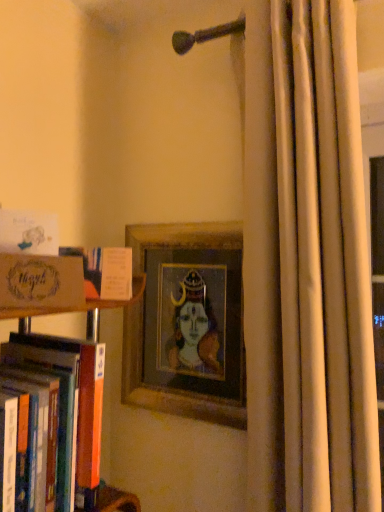
Question: From a real-world perspective, is matte cardboard box at left located beneath beige fabric curtain at right?

Choices:
 (A) no
 (B) yes

Answer: (B)

Question: Can you see matte cardboard box at left touching beige fabric curtain at right?

Choices:
 (A) yes
 (B) no

Answer: (B)

Question: Does matte cardboard box at left lie behind beige fabric curtain at right?

Choices:
 (A) no
 (B) yes

Answer: (A)

Question: From a real-world perspective, is matte cardboard box at left on beige fabric curtain at right?

Choices:
 (A) no
 (B) yes

Answer: (A)

Question: Can you confirm if matte cardboard box at left is shorter than beige fabric curtain at right?

Choices:
 (A) yes
 (B) no

Answer: (A)

Question: From the image's perspective, is wooden picture frame at center above or below matte paper card at left, the 1th book when ordered from top to bottom?

Choices:
 (A) below
 (B) above

Answer: (A)

Question: From their relative heights in the image, would you say wooden picture frame at center is taller or shorter than matte paper card at left, the 1th book when ordered from top to bottom?

Choices:
 (A) short
 (B) tall

Answer: (B)

Question: Choose the correct answer: Is wooden picture frame at center inside matte paper card at left, the 1th book when ordered from top to bottom, or outside it?

Choices:
 (A) outside
 (B) inside

Answer: (A)

Question: From a real-world perspective, is wooden picture frame at center physically located above or below matte paper card at left, marked as the third book in a bottom-to-top arrangement?

Choices:
 (A) below
 (B) above

Answer: (A)

Question: Would you say wooden picture frame at center is to the left or to the right of orange hardcover book at left, the 3th book when ordered from top to bottom, in the picture?

Choices:
 (A) right
 (B) left

Answer: (A)

Question: From their relative heights in the image, would you say wooden picture frame at center is taller or shorter than orange hardcover book at left, the 3th book when ordered from top to bottom?

Choices:
 (A) short
 (B) tall

Answer: (B)

Question: In terms of width, does wooden picture frame at center look wider or thinner when compared to orange hardcover book at left, the 3th book when ordered from top to bottom?

Choices:
 (A) wide
 (B) thin

Answer: (B)

Question: From a real-world perspective, is wooden picture frame at center above or below orange hardcover book at left, the 3th book when ordered from top to bottom?

Choices:
 (A) above
 (B) below

Answer: (A)

Question: In terms of size, does orange cardboard book at left, acting as the second book starting from the bottom, appear bigger or smaller than wooden picture frame at center?

Choices:
 (A) big
 (B) small

Answer: (B)

Question: In the image, is orange cardboard book at left, acting as the second book starting from the bottom, positioned in front of or behind wooden picture frame at center?

Choices:
 (A) behind
 (B) front

Answer: (B)